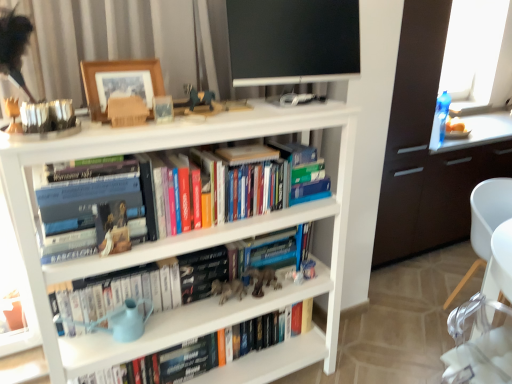
Find the location of a particular element. The image size is (512, 384). vacant space to the left of white plastic chair at lower right is located at coordinates (402, 327).